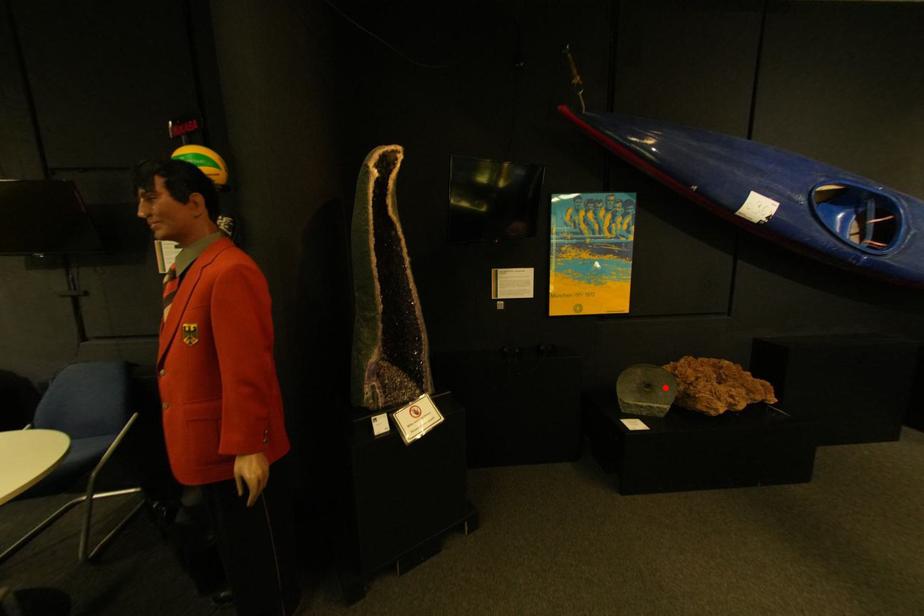
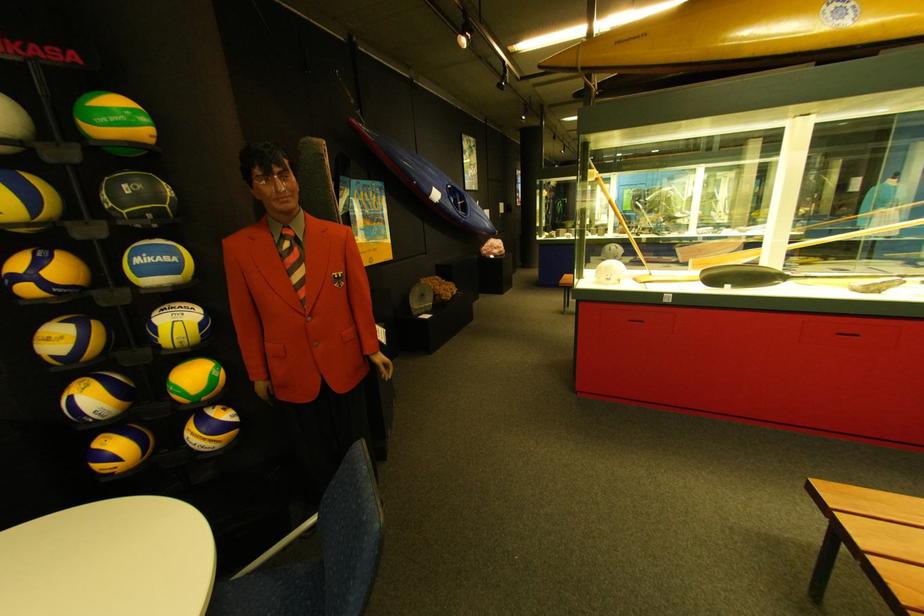
Question: A red point is marked in image1. In image2, is the corresponding 3D point closer to the camera or farther? Reply with the corresponding letter.

Choices:
 (A) The corresponding 3D point is closer.
 (B) The corresponding 3D point is farther.

Answer: (A)